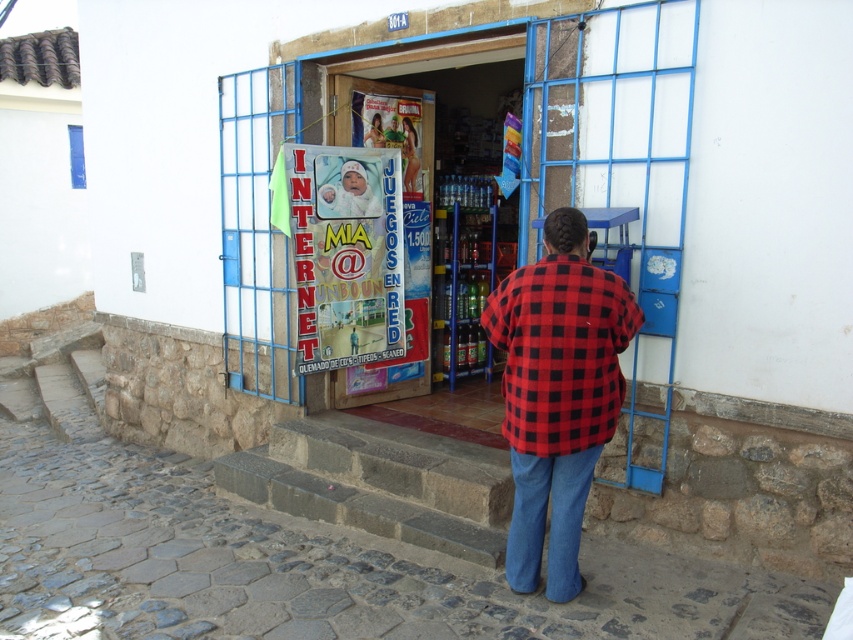
Does clear plastic bottles at center come in front of blue denim jeans at lower center?

No, it is not.

Which is below, clear plastic bottles at center or blue denim jeans at lower center?

blue denim jeans at lower center is lower down.

I want to click on clear plastic bottles at center, so click(x=463, y=273).

Who is more forward, (549, 269) or (521, 492)?

Positioned in front is point (549, 269).

Consider the image. Which is above, red checkered shirt at center or blue denim jeans at lower center?

red checkered shirt at center

Is point (560, 438) positioned in front of point (560, 547)?

That is True.

The width and height of the screenshot is (853, 640). In order to click on red checkered shirt at center in this screenshot , I will do `click(556, 394)`.

From the picture: Can you confirm if red checkered shirt at center is taller than clear plastic bottles at center?

No.

Based on the photo, does red checkered shirt at center have a larger size compared to clear plastic bottles at center?

Actually, red checkered shirt at center might be smaller than clear plastic bottles at center.

The width and height of the screenshot is (853, 640). I want to click on red checkered shirt at center, so click(x=556, y=394).